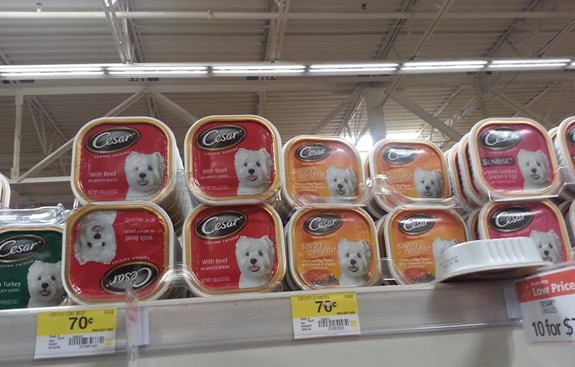
Image resolution: width=575 pixels, height=367 pixels. Identify the location of shelf. (189, 319).